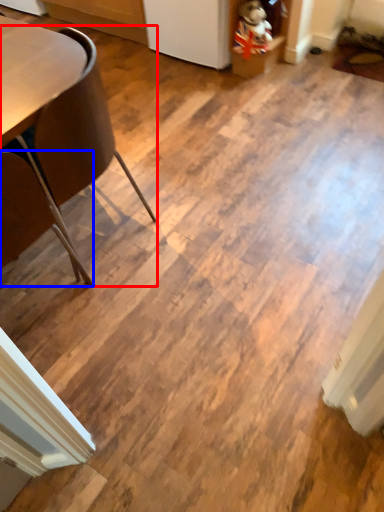
Question: Which object is closer to the camera taking this photo, chair (highlighted by a red box) or chair (highlighted by a blue box)?

Choices:
 (A) chair
 (B) chair

Answer: (B)